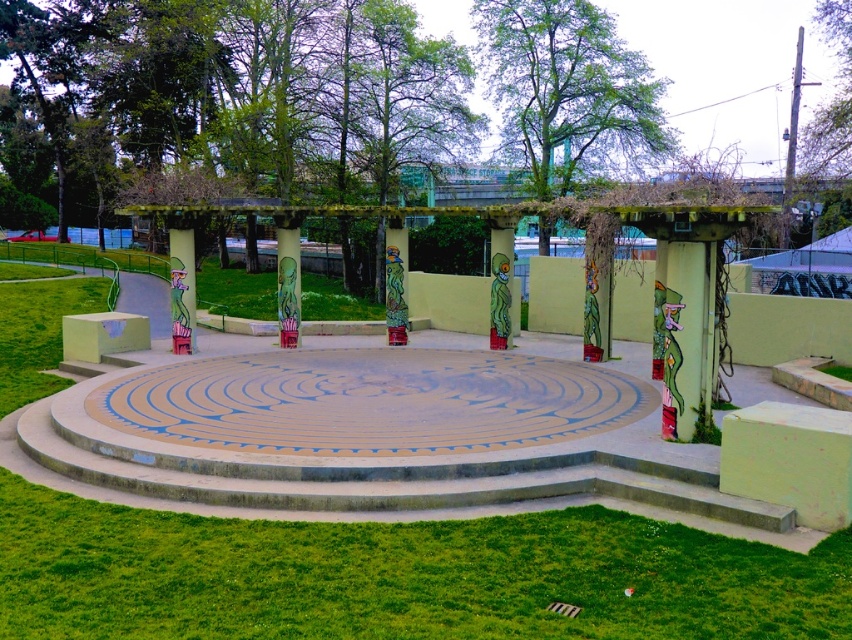
Question: Considering the real-world distances, which object is closest to the matte green pillar at center?

Choices:
 (A) green grass at center
 (B) green matte column at center-right

Answer: (A)

Question: Can you confirm if green grass at center is thinner than matte green pillar at center?

Choices:
 (A) yes
 (B) no

Answer: (B)

Question: Which object is farther from the camera taking this photo?

Choices:
 (A) green matte column at center-right
 (B) beige textured mosaic at center

Answer: (A)

Question: Does green grass at center appear on the right side of beige textured mosaic at center?

Choices:
 (A) yes
 (B) no

Answer: (B)

Question: Can you confirm if beige textured mosaic at center is wider than matte green pillar at center?

Choices:
 (A) yes
 (B) no

Answer: (A)

Question: Which object is closer to the camera taking this photo?

Choices:
 (A) green grass at lower left
 (B) green grass at center
 (C) matte green pillar at center
 (D) green matte column at center-right

Answer: (B)